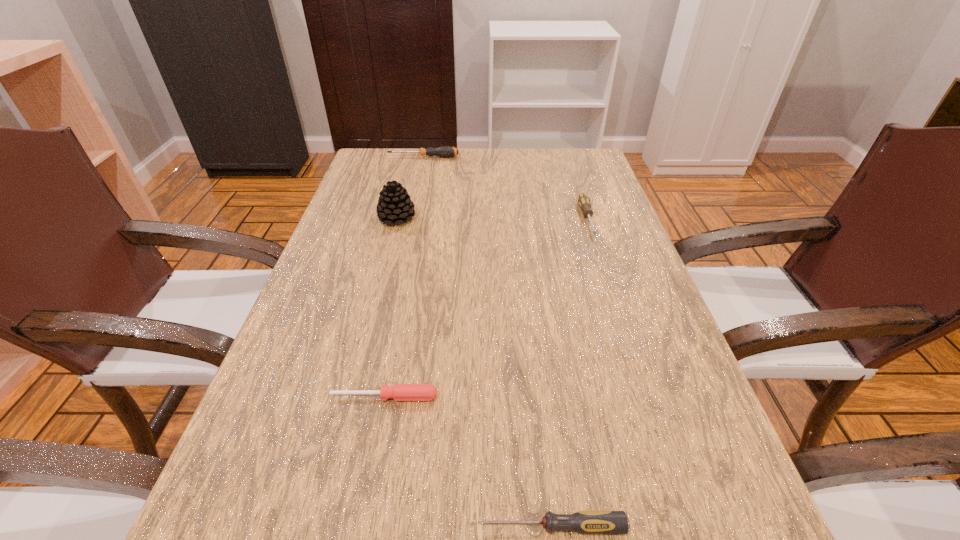
Identify the location of free location located insert the nearest screwdriver into a screw head. The image size is (960, 540). (433, 526).

I want to click on free location located 0.320m insert the nearest screwdriver into a screw head, so click(x=236, y=526).

Locate an element on the screen. This screenshot has width=960, height=540. free space located insert the nearest screwdriver into a screw head is located at coordinates (304, 526).

Image resolution: width=960 pixels, height=540 pixels. Identify the location of free space located on the right of the second nearest object. (612, 397).

The height and width of the screenshot is (540, 960). Identify the location of object that is at the far edge. (446, 151).

Where is `pinecone located in the left edge section of the desktop`? Image resolution: width=960 pixels, height=540 pixels. pinecone located in the left edge section of the desktop is located at coordinates (394, 204).

Where is `object present at the right edge`? object present at the right edge is located at coordinates (583, 200).

Find the location of a particular element. The image size is (960, 540). object positioned at the far left corner is located at coordinates (446, 151).

This screenshot has width=960, height=540. In order to click on vacant space at the far edge of the desktop in this screenshot , I will do `click(526, 176)`.

At what (x,y) coordinates should I click in order to perform the action: click on free location at the left edge of the desktop. Please return your answer as a coordinate pair (x, y). This screenshot has height=540, width=960. Looking at the image, I should click on (382, 261).